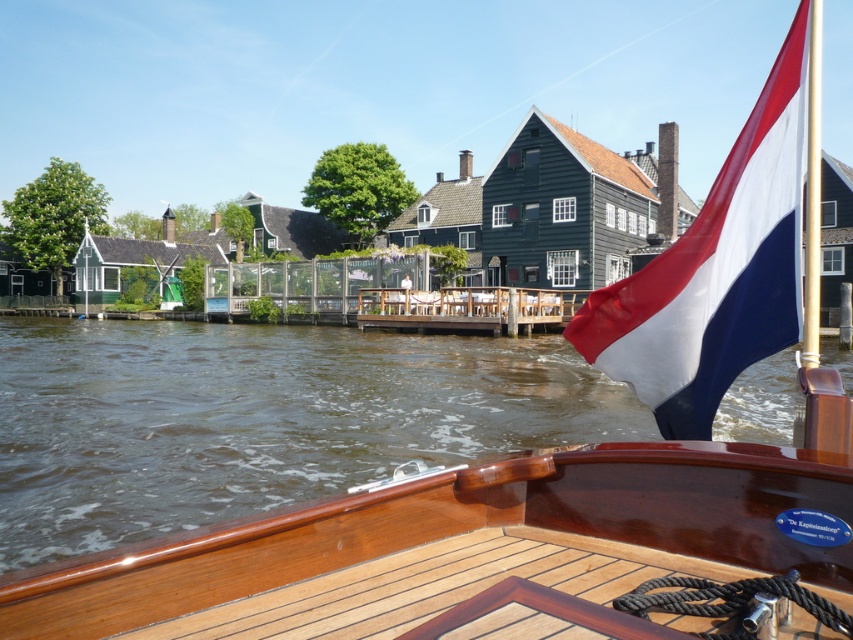
Between brown water at center and polished wood flagpole at upper right, which one appears on the right side from the viewer's perspective?

From the viewer's perspective, polished wood flagpole at upper right appears more on the right side.

How far apart are brown water at center and polished wood flagpole at upper right?

The distance of brown water at center from polished wood flagpole at upper right is 10.25 meters.

Which is in front, point (364, 445) or point (810, 272)?

Positioned in front is point (810, 272).

Find the location of a particular element. brown water at center is located at coordinates (258, 419).

Does point (643, 292) come farther from viewer compared to point (820, 92)?

No, it is not.

Which is behind, point (601, 326) or point (814, 268)?

Positioned behind is point (601, 326).

Where is `tri-color fabric flag at upper right`? Image resolution: width=853 pixels, height=640 pixels. tri-color fabric flag at upper right is located at coordinates (717, 269).

Who is more forward, (x=641, y=424) or (x=776, y=227)?

Point (x=776, y=227)

Does brown water at center appear over tri-color fabric flag at upper right?

Actually, brown water at center is below tri-color fabric flag at upper right.

Does point (553, 422) come in front of point (672, 429)?

No, (553, 422) is behind (672, 429).

Find the location of a particular element. brown water at center is located at coordinates (258, 419).